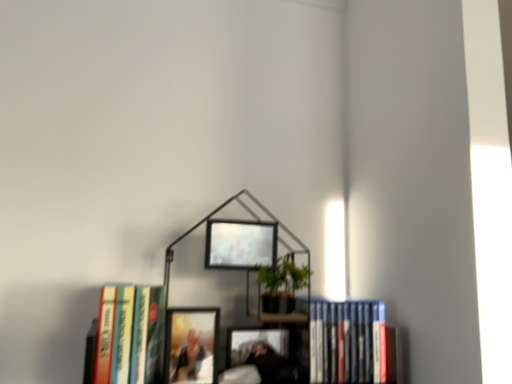
Question: From the image's perspective, is metallic silver picture frame at upper center, the 2th picture frame ordered from the bottom, above or below metallic black bookcase at center?

Choices:
 (A) above
 (B) below

Answer: (A)

Question: Is metallic silver picture frame at upper center, the 2th picture frame ordered from the bottom, inside or outside of metallic black bookcase at center?

Choices:
 (A) outside
 (B) inside

Answer: (B)

Question: Considering the real-world distances, which object is farthest from the metallic silver picture frame at upper center, the 2th picture frame ordered from the bottom?

Choices:
 (A) blue hardcover book at lower right, which ranks as the first book in right-to-left order
 (B) hardcover book at left, arranged as the 2th book when viewed from the right
 (C) matte wooden picture frame at center, the second picture frame when ordered from right to left
 (D) metallic black bookcase at center

Answer: (A)

Question: Which of these objects is positioned farthest from the hardcover book at left, arranged as the 2th book when viewed from the right?

Choices:
 (A) metallic black bookcase at center
 (B) matte wooden picture frame at center, arranged as the first picture frame when viewed from the left
 (C) blue hardcover book at lower right, which ranks as the first book in right-to-left order
 (D) metallic silver picture frame at upper center, the 2th picture frame when ordered from left to right

Answer: (C)